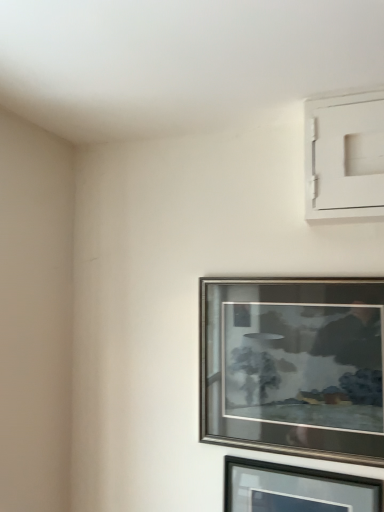
Question: From the image's perspective, relative to black glass picture frame at lower right, the second picture frame from the top, is silver metallic picture frame at center, the 1th picture frame when ordered from top to bottom, above or below?

Choices:
 (A) above
 (B) below

Answer: (A)

Question: Is silver metallic picture frame at center, the 1th picture frame when ordered from top to bottom, to the left or to the right of black glass picture frame at lower right, the second picture frame from the top, in the image?

Choices:
 (A) left
 (B) right

Answer: (A)

Question: Is point (269, 284) positioned closer to the camera than point (233, 476)?

Choices:
 (A) farther
 (B) closer

Answer: (B)

Question: Which is correct: black glass picture frame at lower right, the second picture frame from the top, is inside silver metallic picture frame at center, positioned as the second picture frame in bottom-to-top order, or outside of it?

Choices:
 (A) outside
 (B) inside

Answer: (A)

Question: From a real-world perspective, is black glass picture frame at lower right, the second picture frame from the top, positioned above or below silver metallic picture frame at center, positioned as the second picture frame in bottom-to-top order?

Choices:
 (A) below
 (B) above

Answer: (A)

Question: Considering their positions, is black glass picture frame at lower right, the second picture frame from the top, located in front of or behind silver metallic picture frame at center, positioned as the second picture frame in bottom-to-top order?

Choices:
 (A) behind
 (B) front

Answer: (B)

Question: Based on their sizes in the image, would you say black glass picture frame at lower right, the second picture frame from the top, is bigger or smaller than silver metallic picture frame at center, positioned as the second picture frame in bottom-to-top order?

Choices:
 (A) small
 (B) big

Answer: (A)